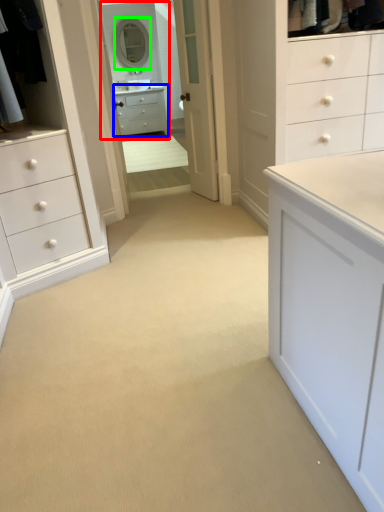
Question: Based on their relative distances, which object is nearer to mirror (highlighted by a red box)? Choose from chest of drawers (highlighted by a blue box) and mirror (highlighted by a green box).

Choices:
 (A) chest of drawers
 (B) mirror

Answer: (A)